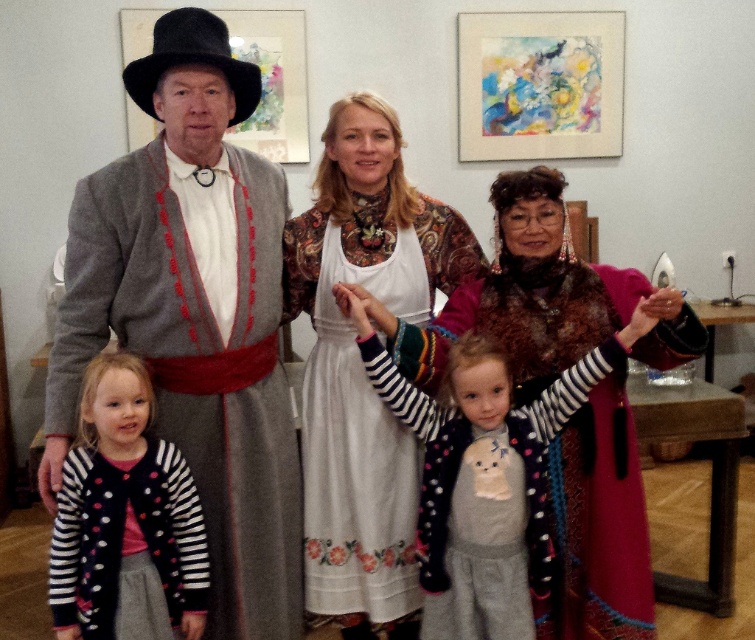
Based on the provided scene description, where is the white cotton dress at center located in terms of its 2D coordinates?

The white cotton dress at center is located at the 2D coordinates of point (359, 362).

You are a tailor who needs to determine which garment requires more fabric to alter. Which one is larger in size between the matte gray coat at left and the striped knit cardigan at lower left?

The matte gray coat at left is bigger than the striped knit cardigan at lower left, so it requires more fabric to alter.

In the image, there is a white cotton dress at center and a striped knit cardigan at lower left. Which one is positioned to the right of the other?

The white cotton dress at center is to the right of the striped knit cardigan at lower left.